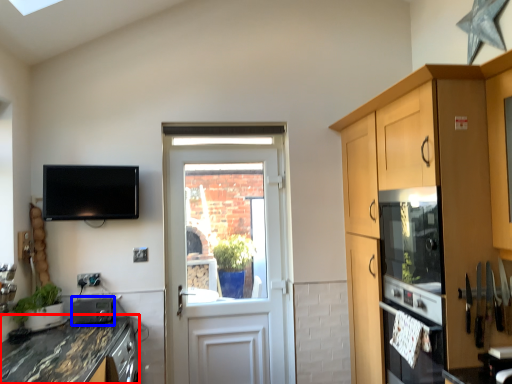
Question: Which point is closer to the camera, countertop (highlighted by a red box) or appliance (highlighted by a blue box)?

Choices:
 (A) countertop
 (B) appliance

Answer: (A)